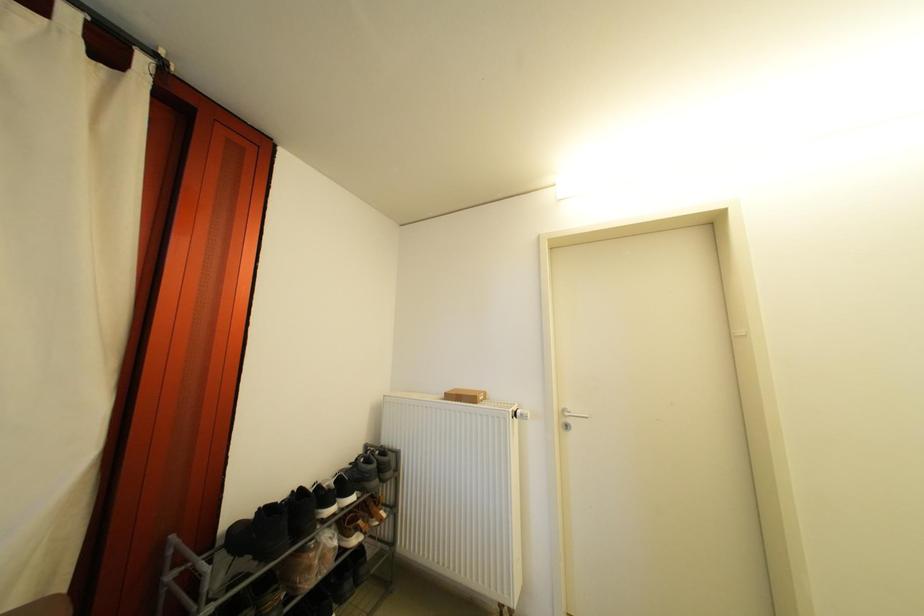
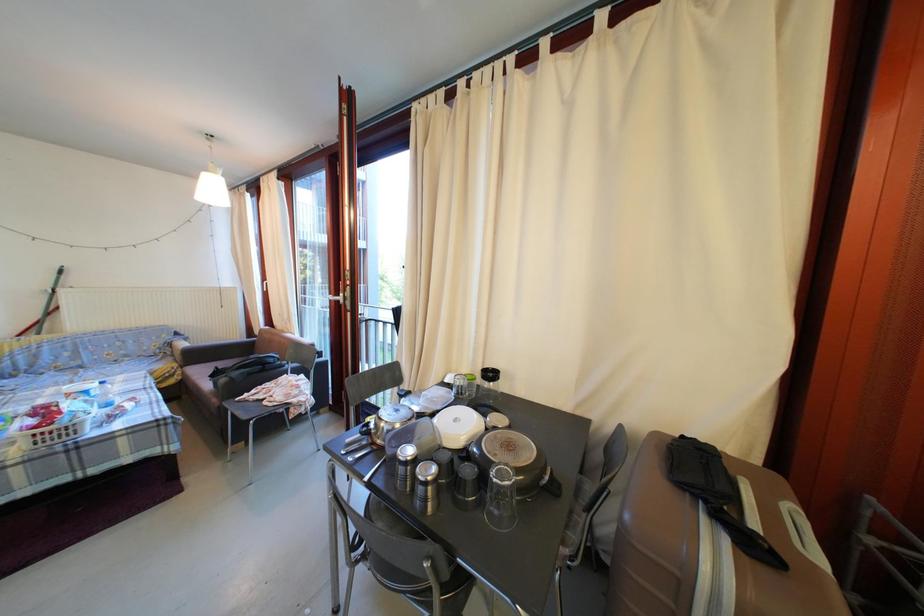
Question: The camera is either moving clockwise (left) or counter-clockwise (right) around the object. The first image is from the beginning of the video and the second image is from the end. Is the camera moving left or right when shooting the video?

Choices:
 (A) Left
 (B) Right

Answer: (B)